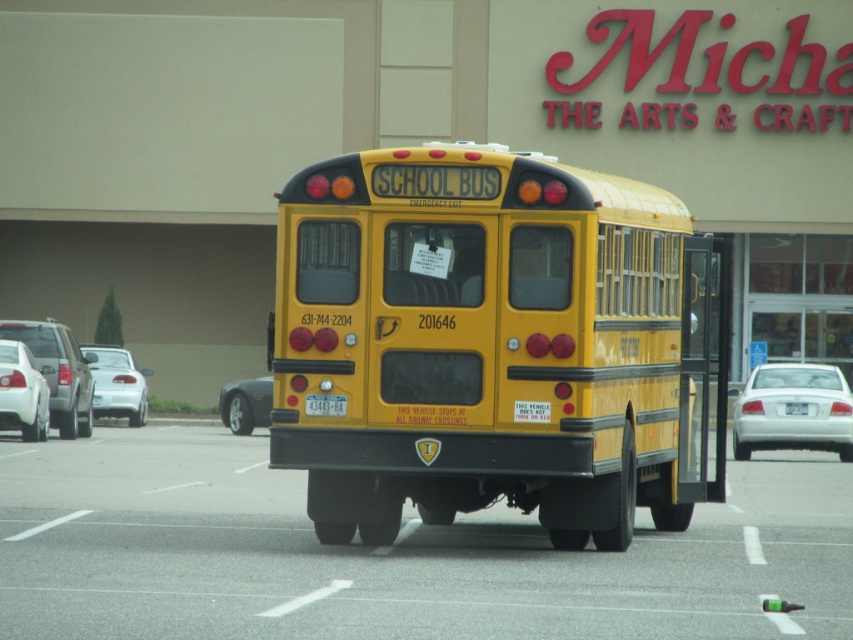
Question: Is shiny black car at lower left bigger than white plastic license plate at center?

Choices:
 (A) no
 (B) yes

Answer: (B)

Question: Is matte silver suv at left in front of shiny black car at lower left?

Choices:
 (A) yes
 (B) no

Answer: (A)

Question: Which is nearer to the white matte car at left?

Choices:
 (A) yellow matte school bus at center
 (B) matte silver suv at left
 (C) yellow matte/solid school bus at center

Answer: (B)

Question: Can you confirm if matte silver suv at left is smaller than shiny black car at lower left?

Choices:
 (A) no
 (B) yes

Answer: (A)

Question: Estimate the real-world distances between objects in this image. Which object is farther from the shiny black car at lower left?

Choices:
 (A) yellow matte school bus at center
 (B) white glossy sedan at left
 (C) white plastic license plate at center
 (D) white glossy sedan at right

Answer: (A)

Question: Which object is the farthest from the yellow matte license plate at center?

Choices:
 (A) yellow matte/solid school bus at center
 (B) white plastic license plate at center

Answer: (B)